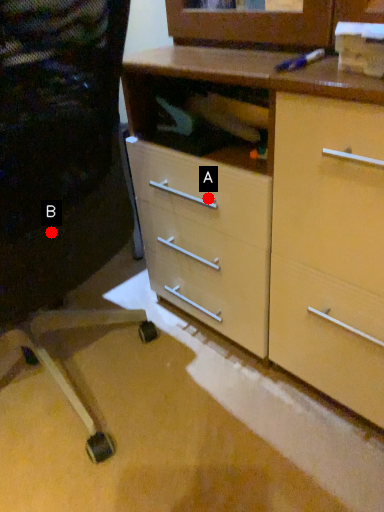
Question: Two points are circled on the image, labeled by A and B beside each circle. Which point is further to the camera?

Choices:
 (A) A is further
 (B) B is further

Answer: (A)